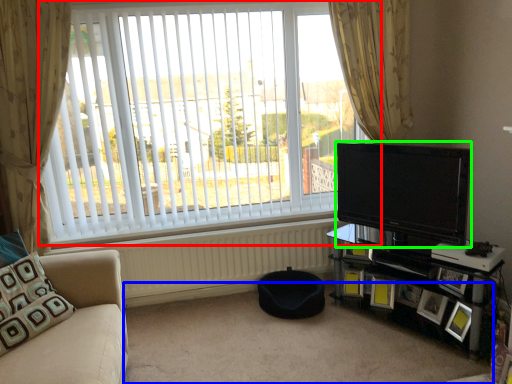
Question: Considering the real-world distances, which object is closest to window (highlighted by a red box)? plain (highlighted by a blue box) or television (highlighted by a green box).

Choices:
 (A) plain
 (B) television

Answer: (B)